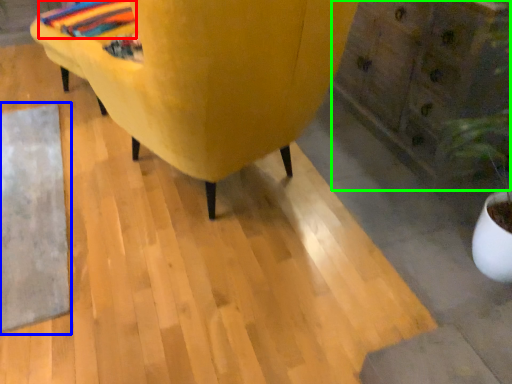
Question: Which object is the closest to the blanket (highlighted by a red box)? Choose among these: mat (highlighted by a blue box) or dresser (highlighted by a green box).

Choices:
 (A) mat
 (B) dresser

Answer: (A)